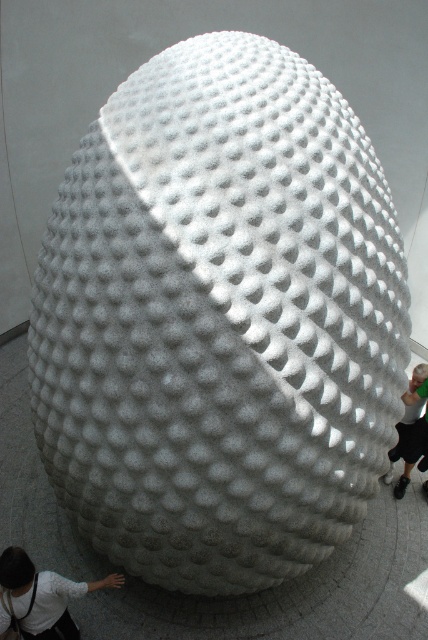
You are an artist standing in front of the sculpture. You notice a white textured shirt at lower left and a green fabric pants at lower right. Which clothing item is shorter in height?

The white textured shirt at lower left is not as tall as the green fabric pants at lower right, so the white textured shirt at lower left is shorter in height.

You are an artist standing in front of the sculpture and you want to place a new artwork between the white textured shirt at lower left and the green fabric pants at lower right. Can you fit it there?

The white textured shirt at lower left is in front of the green fabric pants at lower right, so there is no space between them for the new artwork to be placed.

You are standing in front of the sculpture and notice two points marked on it. The first point is at coordinate point (17, 620) and the second is at point (419, 365). Which of these points is nearer to your eyes?

Point (17, 620) is closer to the camera than point (419, 365), so the first point is nearer to your eyes.